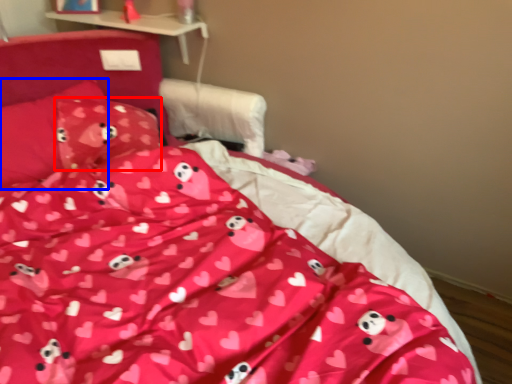
Question: Which object is further to the camera taking this photo, pillow (highlighted by a red box) or pillow (highlighted by a blue box)?

Choices:
 (A) pillow
 (B) pillow

Answer: (A)